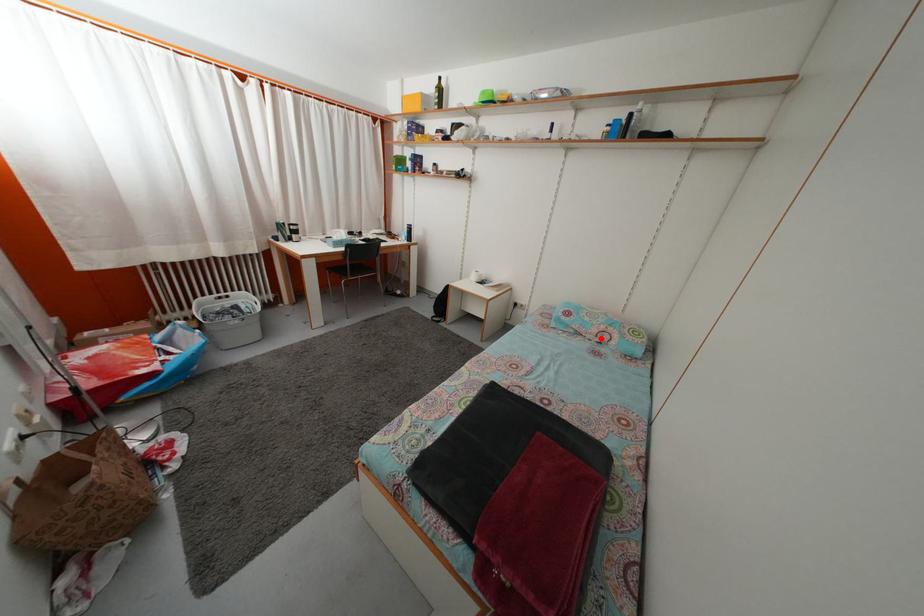
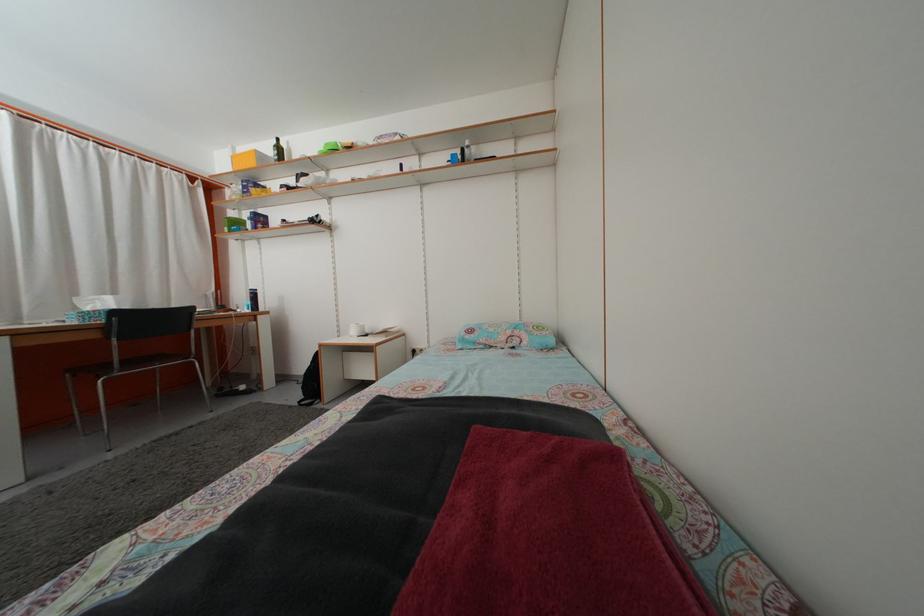
Question: I am providing you with two images of the same scene from different viewpoints. A red point is marked on the first image. At the location where the point appears in image 1, is it still visible in image 2?

Choices:
 (A) Yes
 (B) No

Answer: (A)